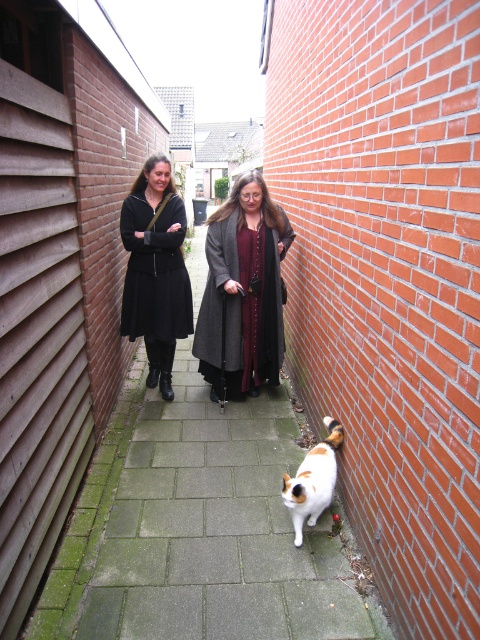
You are a delivery person who needs to pass through the alleyway. You see a dark gray wool coat at center and a white fur cat at center. Which object is taller and requires more clearance?

The dark gray wool coat at center is much taller than the white fur cat at center, so it requires more clearance.